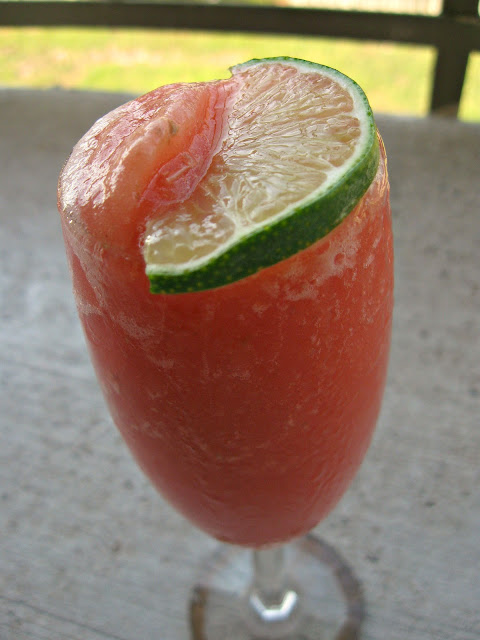
Identify the location of bottom of wine glass. The image size is (480, 640). (332, 566), (312, 614), (217, 616), (228, 578).